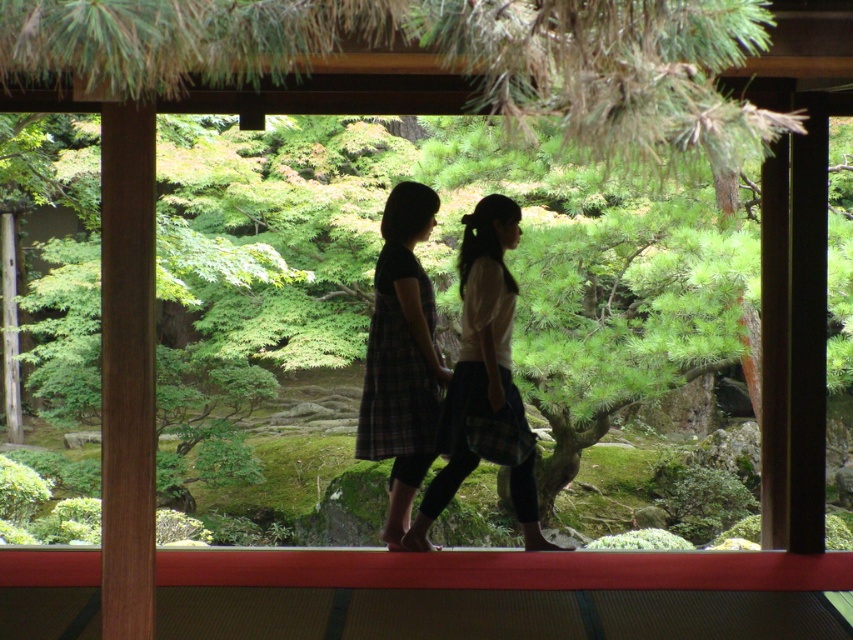
Question: Considering the relative positions of silhouette plaid skirt at center and plaid fabric dress at center in the image provided, where is silhouette plaid skirt at center located with respect to plaid fabric dress at center?

Choices:
 (A) left
 (B) right

Answer: (B)

Question: Is silhouette plaid skirt at center to the left of plaid fabric dress at center from the viewer's perspective?

Choices:
 (A) no
 (B) yes

Answer: (A)

Question: Is silhouette plaid skirt at center positioned at the back of plaid fabric dress at center?

Choices:
 (A) no
 (B) yes

Answer: (A)

Question: Among these points, which one is nearest to the camera?

Choices:
 (A) (468, 394)
 (B) (381, 346)

Answer: (A)

Question: Which point is closer to the camera?

Choices:
 (A) plaid fabric dress at center
 (B) silhouette plaid skirt at center

Answer: (B)